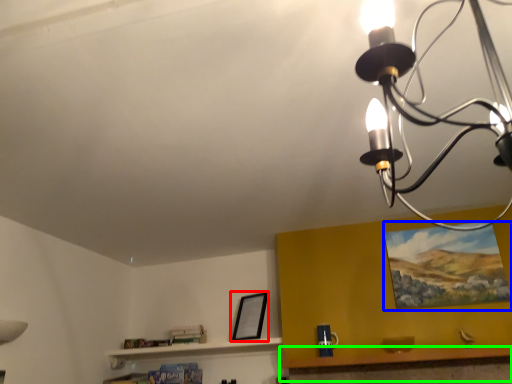
Question: Which is nearer to the picture frame (highlighted by a red box)? picture frame (highlighted by a blue box) or table (highlighted by a green box).

Choices:
 (A) picture frame
 (B) table

Answer: (B)